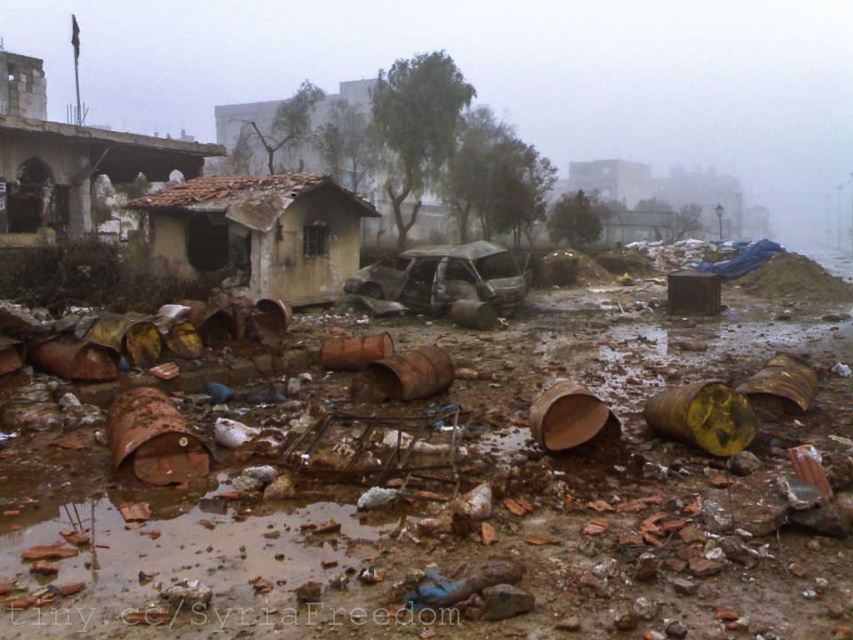
Is brown corrugated metal hut at center wider than rusty metal hut at upper center?

Yes, brown corrugated metal hut at center is wider than rusty metal hut at upper center.

Consider the image. Can you confirm if brown corrugated metal hut at center is thinner than rusty metal hut at upper center?

Incorrect, brown corrugated metal hut at center's width is not less than rusty metal hut at upper center's.

Is point (451, 125) positioned after point (593, 177)?

No, it is in front of (593, 177).

This screenshot has height=640, width=853. In order to click on brown corrugated metal hut at center in this screenshot , I will do `click(332, 145)`.

Does yellowish concrete hut at center have a larger size compared to brown corrugated metal hut at center?

Incorrect, yellowish concrete hut at center is not larger than brown corrugated metal hut at center.

Which is more to the left, yellowish concrete hut at center or brown corrugated metal hut at center?

brown corrugated metal hut at center is more to the left.

You are a GUI agent. You are given a task and a screenshot of the screen. Output one action in this format:
    pyautogui.click(x=<x>, y=<y>)
    Task: Click on the yellowish concrete hut at center
    Image resolution: width=853 pixels, height=640 pixels.
    Given the screenshot: What is the action you would take?
    pyautogui.click(x=258, y=234)

In the scene shown: Does yellowish concrete hut at center have a greater width compared to rusty metal hut at upper center?

No, yellowish concrete hut at center is not wider than rusty metal hut at upper center.

Is yellowish concrete hut at center taller than rusty metal hut at upper center?

No.

At what (x,y) coordinates should I click in order to perform the action: click on yellowish concrete hut at center. Please return your answer as a coordinate pair (x, y). This screenshot has width=853, height=640. Looking at the image, I should click on (258, 234).